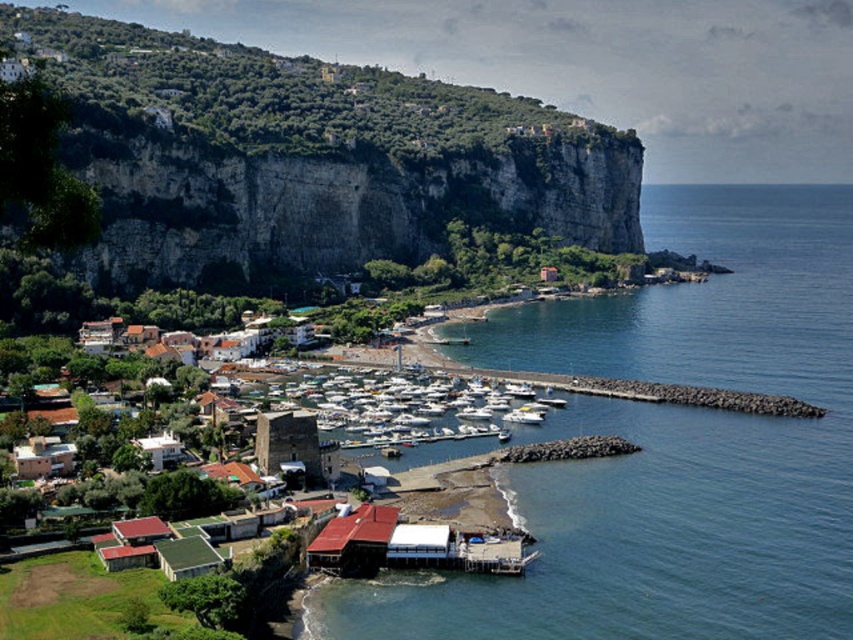
Question: Can you confirm if rugged stone cliff at upper left is positioned to the right of wooden pier at lower center?

Choices:
 (A) no
 (B) yes

Answer: (A)

Question: Which point appears farthest from the camera in this image?

Choices:
 (A) (280, 417)
 (B) (442, 550)
 (C) (137, 205)
 (D) (349, 547)

Answer: (C)

Question: Is white matte boats at center above wooden pier at lower center?

Choices:
 (A) no
 (B) yes

Answer: (B)

Question: Which object is positioned farthest from the stone tower at center?

Choices:
 (A) wooden pier at lower center
 (B) blue water at lower center

Answer: (B)

Question: Is rugged stone cliff at upper left wider than red corrugated metal hut at lower center?

Choices:
 (A) no
 (B) yes

Answer: (B)

Question: Which point is farther to the camera?

Choices:
 (A) (376, 412)
 (B) (427, 547)
 (C) (310, 445)
 (D) (697, 444)

Answer: (A)